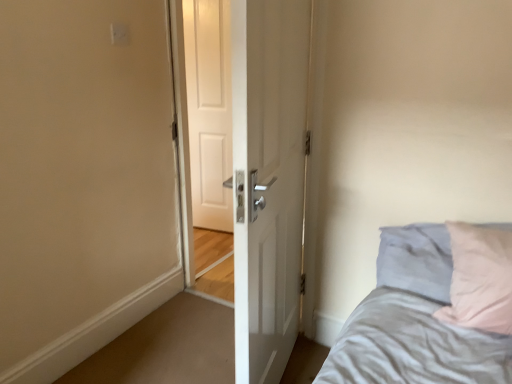
Question: Considering the positions of point (220, 119) and point (119, 23), is point (220, 119) closer or farther from the camera than point (119, 23)?

Choices:
 (A) farther
 (B) closer

Answer: (A)

Question: From a real-world perspective, is white matte door at center positioned above or below white plastic electric outlet at upper center?

Choices:
 (A) above
 (B) below

Answer: (B)

Question: Which object is positioned farthest from the white plastic electric outlet at upper center?

Choices:
 (A) white matte door at center
 (B) white glossy door at center

Answer: (A)

Question: Which of these objects is positioned closest to the white matte door at center?

Choices:
 (A) white glossy door at center
 (B) white plastic electric outlet at upper center

Answer: (B)